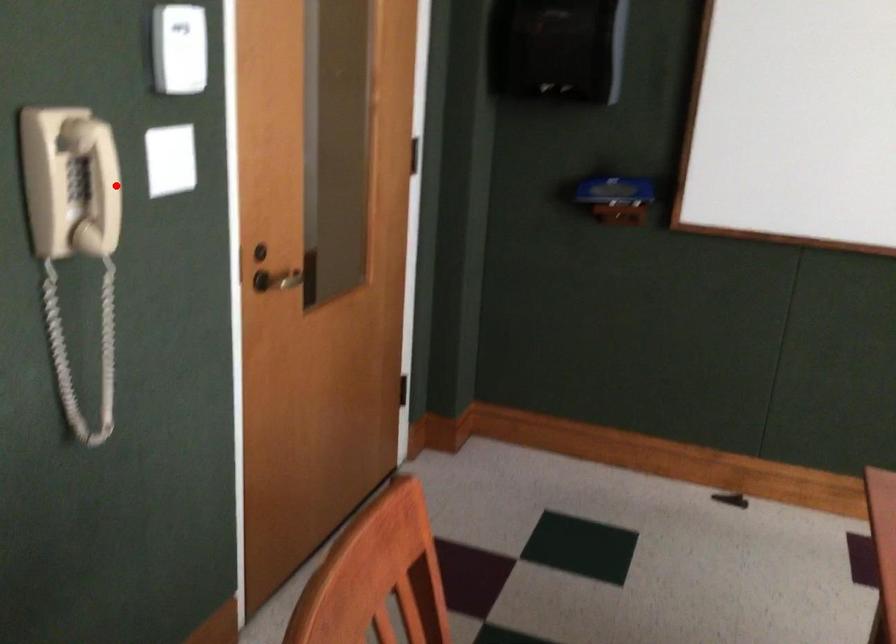
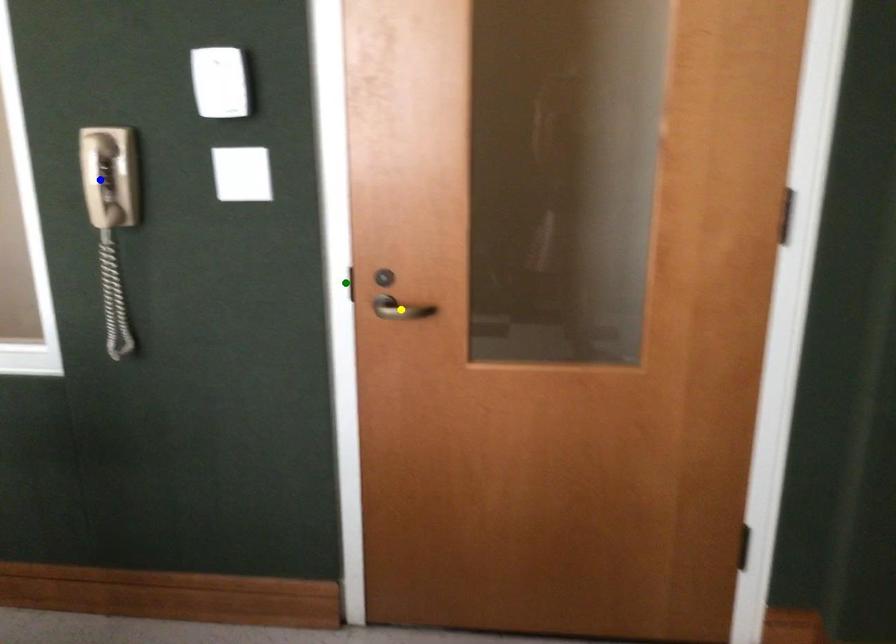
Question: I am providing you with two images of the same scene from different viewpoints. A red point is marked on the first image. You are given multiple points on the second image. In image 2, which mark is for the same physical point as the one in image 1?

Choices:
 (A) green point
 (B) blue point
 (C) yellow point

Answer: (B)